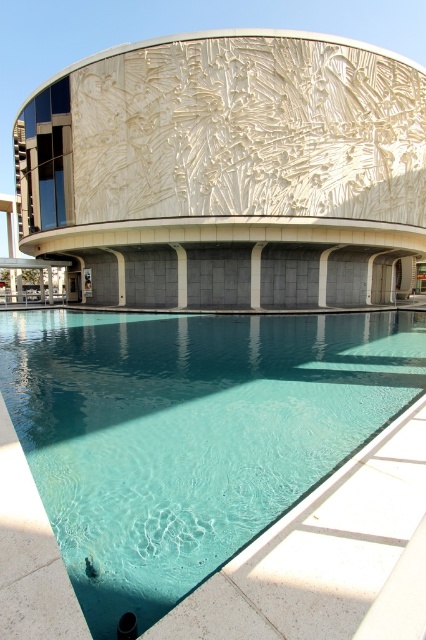
Question: Which object is farther from the camera taking this photo?

Choices:
 (A) clear glass pool at lower center
 (B) white textured wall at center

Answer: (B)

Question: Does clear glass pool at lower center come behind white textured wall at center?

Choices:
 (A) no
 (B) yes

Answer: (A)

Question: Is clear glass pool at lower center above white textured wall at center?

Choices:
 (A) no
 (B) yes

Answer: (A)

Question: Is clear glass pool at lower center bigger than white textured wall at center?

Choices:
 (A) yes
 (B) no

Answer: (B)